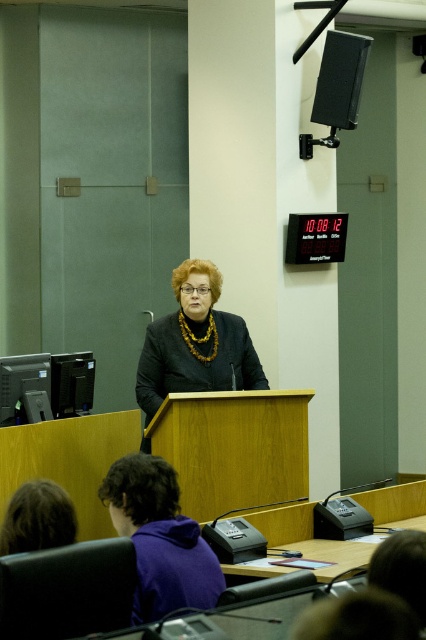
Is purple fleece at lower left to the right of matte black speaker at upper right from the viewer's perspective?

No, purple fleece at lower left is not to the right of matte black speaker at upper right.

The width and height of the screenshot is (426, 640). What do you see at coordinates (160, 538) in the screenshot?
I see `purple fleece at lower left` at bounding box center [160, 538].

Does point (126, 474) lie in front of point (333, 68)?

Yes, point (126, 474) is in front of point (333, 68).

This screenshot has height=640, width=426. I want to click on purple fleece at lower left, so click(x=160, y=538).

Where is `black plastic printer at left`? This screenshot has height=640, width=426. black plastic printer at left is located at coordinates (25, 388).

The height and width of the screenshot is (640, 426). What do you see at coordinates (25, 388) in the screenshot?
I see `black plastic printer at left` at bounding box center [25, 388].

I want to click on black plastic printer at left, so click(x=25, y=388).

Which of these two, matte black jacket at center or matte black speaker at upper right, stands shorter?

matte black speaker at upper right

Does matte black jacket at center have a lesser width compared to matte black speaker at upper right?

No.

Is point (204, 330) farther from viewer compared to point (345, 97)?

No, it is in front of (345, 97).

Locate an element on the screen. Image resolution: width=426 pixels, height=640 pixels. matte black jacket at center is located at coordinates (195, 342).